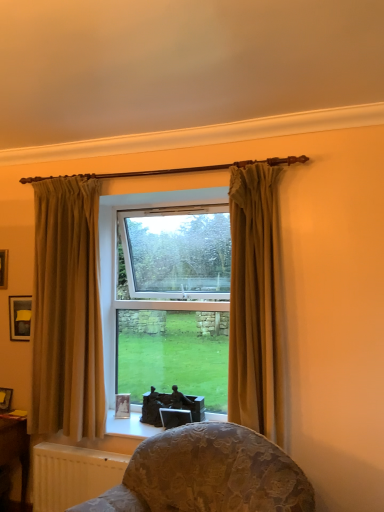
Question: Considering the relative sizes of matte beige curtain at left, which is counted as the second curtain, starting from the right, and white textured radiator at lower left in the image provided, is matte beige curtain at left, which is counted as the second curtain, starting from the right, smaller than white textured radiator at lower left?

Choices:
 (A) no
 (B) yes

Answer: (A)

Question: Is matte beige curtain at left, placed as the 2th curtain when sorted from front to back, further to the viewer compared to white textured radiator at lower left?

Choices:
 (A) yes
 (B) no

Answer: (A)

Question: From the image's perspective, is matte beige curtain at left, placed as the 2th curtain when sorted from front to back, located beneath white textured radiator at lower left?

Choices:
 (A) no
 (B) yes

Answer: (A)

Question: Considering the relative positions of matte beige curtain at left, placed as the 2th curtain when sorted from front to back, and white textured radiator at lower left in the image provided, is matte beige curtain at left, placed as the 2th curtain when sorted from front to back, in front of white textured radiator at lower left?

Choices:
 (A) yes
 (B) no

Answer: (B)

Question: Can you confirm if matte beige curtain at left, positioned as the 1th curtain in back-to-front order, is thinner than white textured radiator at lower left?

Choices:
 (A) yes
 (B) no

Answer: (B)

Question: Considering the positions of matte black picture frame at upper left, which is the fourth picture frame from right to left, and wooden table at lower left in the image, is matte black picture frame at upper left, which is the fourth picture frame from right to left, taller or shorter than wooden table at lower left?

Choices:
 (A) tall
 (B) short

Answer: (B)

Question: Is matte black picture frame at upper left, acting as the first picture frame starting from the top, in front of or behind wooden table at lower left in the image?

Choices:
 (A) behind
 (B) front

Answer: (A)

Question: Considering the relative positions of matte black picture frame at upper left, placed as the first picture frame when sorted from left to right, and wooden table at lower left in the image provided, is matte black picture frame at upper left, placed as the first picture frame when sorted from left to right, to the left or to the right of wooden table at lower left?

Choices:
 (A) right
 (B) left

Answer: (B)

Question: Which is correct: matte black picture frame at upper left, acting as the first picture frame starting from the top, is inside wooden table at lower left, or outside of it?

Choices:
 (A) inside
 (B) outside

Answer: (B)

Question: Looking at the image, does matte black picture frame at lower left, which is the 3th picture frame in right-to-left order, seem bigger or smaller compared to matte gold curtain at center, which is the 1th curtain in front-to-back order?

Choices:
 (A) big
 (B) small

Answer: (B)

Question: Does point (1, 393) appear closer or farther from the camera than point (241, 339)?

Choices:
 (A) farther
 (B) closer

Answer: (A)

Question: Looking at their shapes, would you say matte black picture frame at lower left, the third picture frame in the top-to-bottom sequence, is wider or thinner than matte gold curtain at center, which ranks as the 2th curtain in back-to-front order?

Choices:
 (A) wide
 (B) thin

Answer: (B)

Question: From the image's perspective, relative to matte gold curtain at center, which is the 1th curtain in front-to-back order, is matte black picture frame at lower left, which ranks as the second picture frame in bottom-to-top order, above or below?

Choices:
 (A) above
 (B) below

Answer: (B)

Question: Is matte black picture frame at lower left, the 2th picture frame from the left, wider or thinner than white textured radiator at lower left?

Choices:
 (A) thin
 (B) wide

Answer: (A)

Question: Considering the positions of matte black picture frame at lower left, which is the 3th picture frame in right-to-left order, and white textured radiator at lower left in the image, is matte black picture frame at lower left, which is the 3th picture frame in right-to-left order, bigger or smaller than white textured radiator at lower left?

Choices:
 (A) small
 (B) big

Answer: (A)